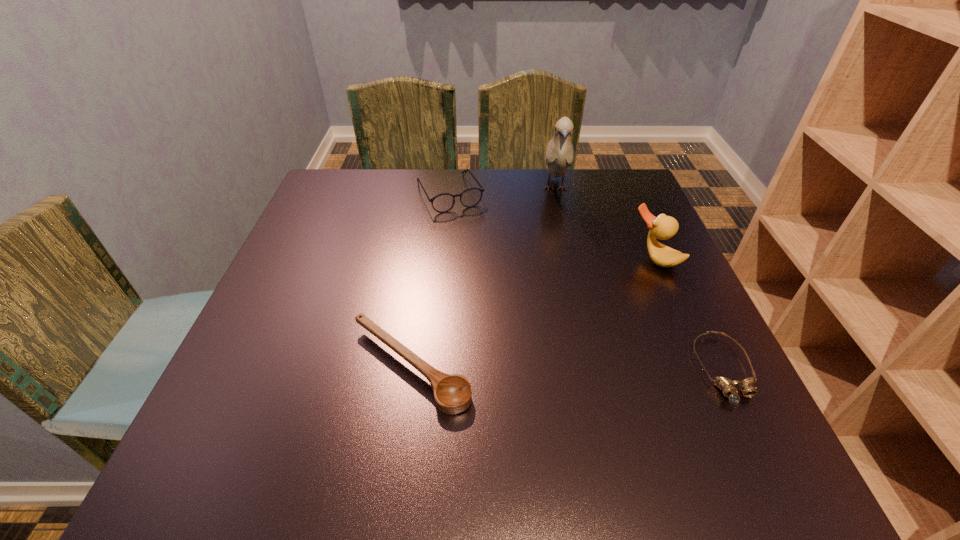
Image resolution: width=960 pixels, height=540 pixels. What are the coordinates of `vacant space on the desktop that is between the wooden spoon and the goggles and is positioned on the beak of the duck` in the screenshot? It's located at (542, 368).

In order to click on free space on the desktop that is between the fourth tallest object and the shortest object and is positioned at the beak of the bird in this screenshot , I will do `click(560, 368)`.

At what (x,y) coordinates should I click in order to perform the action: click on free space on the desktop that is between the second shortest object and the shortest object and is positioned on the front-facing side of the spectacles. Please return your answer as a coordinate pair (x, y). The width and height of the screenshot is (960, 540). Looking at the image, I should click on (550, 368).